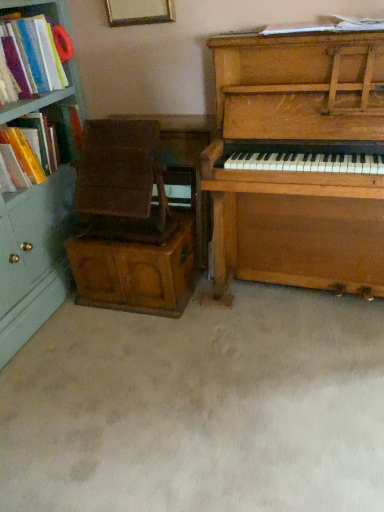
Find the location of a particular element. vacant area that is in front of wooden armchair at center-left, which ranks as the 2th armchair in top-to-bottom order is located at coordinates (132, 348).